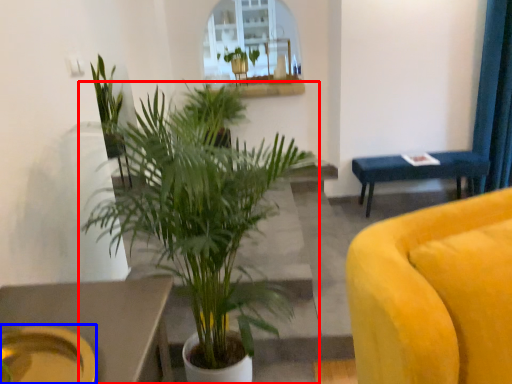
Question: Which of the following is the farthest to the observer, houseplant (highlighted by a red box) or platter (highlighted by a blue box)?

Choices:
 (A) houseplant
 (B) platter

Answer: (A)